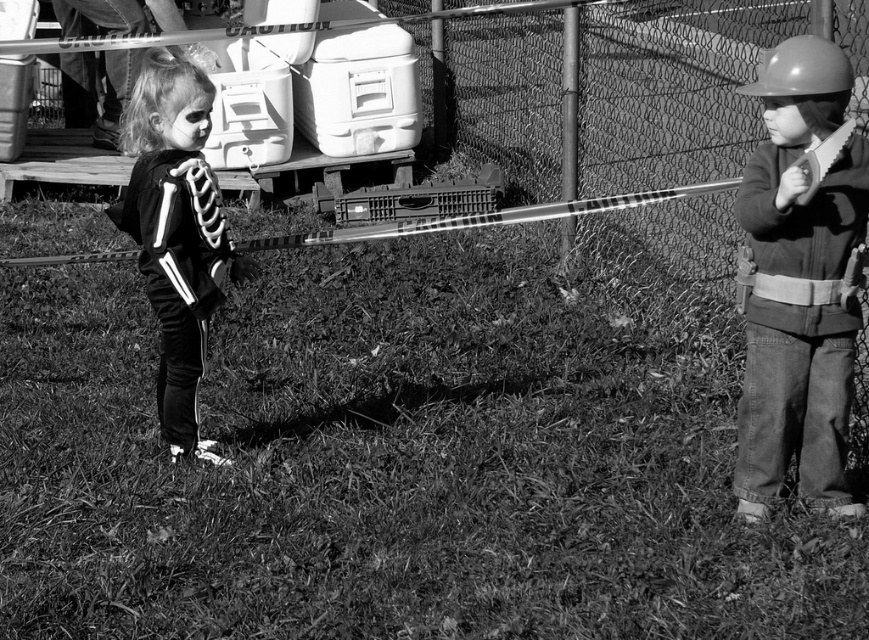
Based on the photo, you are standing 10 feet away from the point at coordinates point [764,166]. Can you reach the point without moving closer?

The distance of point [764,166] from viewer is 12.86 feet, so you are currently 10 feet away, which is closer than the point. Therefore, you can reach the point without moving closer.

What is the color of the costume worn by the child located at the point with coordinates (96, 90) in the image?

The point at coordinates (96, 90) indicates the matte black costume at left, so the costume is matte black.

You are a photographer taking a picture of the two children holding the metallic object. You notice two specific points marked as point 1 at coordinates point (114, 132) and point 2 at coordinates point (787, 58). Which point is closer to the camera?

Point (114, 132) is closer to the camera than point (787, 58) because it is further to the camera.